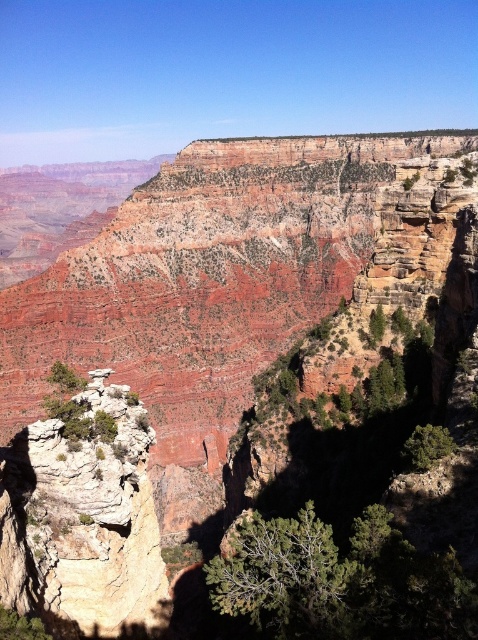
You are standing at the edge of the Grand Canyon and see a point marked at coordinates point (121, 403). If you want to throw a rock to reach that point, is it within your throwing distance of 50 meters?

The point (121, 403) is 45.04 meters away from you, so yes, it is within your throwing distance of 50 meters.

You are standing at the edge of the Grand Canyon and see two points marked on the canyon wall. The first point is at coordinates point (226,580) and the second is at point (428,460). Which point is nearer to your current position?

Point (226,580) is closer to the viewer than point (428,460), so the first point is nearer to your current position.